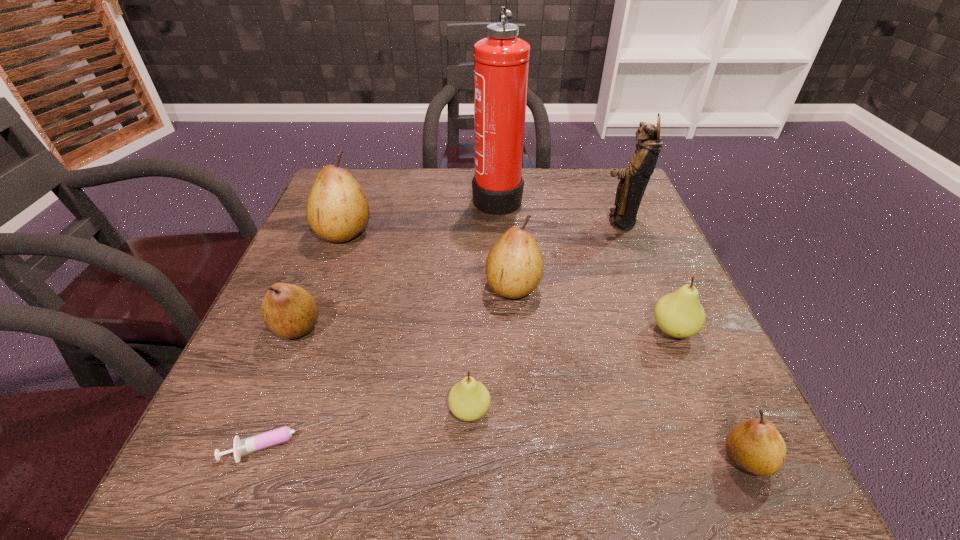
What are the coordinates of `figurine that is at the far edge` in the screenshot? It's located at (634, 179).

At what (x,y) coordinates should I click in order to perform the action: click on pear that is positioned at the near edge. Please return your answer as a coordinate pair (x, y). The image size is (960, 540). Looking at the image, I should click on (755, 445).

Where is `syringe located at the near edge`? syringe located at the near edge is located at coordinates (280, 435).

What are the coordinates of `syringe that is at the left edge` in the screenshot? It's located at (280, 435).

This screenshot has height=540, width=960. In order to click on figurine present at the right edge in this screenshot , I will do `click(634, 179)`.

Locate an element on the screen. The height and width of the screenshot is (540, 960). object that is at the near left corner is located at coordinates (280, 435).

You are a GUI agent. You are given a task and a screenshot of the screen. Output one action in this format:
    pyautogui.click(x=<x>, y=<y>)
    Task: Click on the object at the far right corner
    The image size is (960, 540).
    Given the screenshot: What is the action you would take?
    pyautogui.click(x=634, y=179)

This screenshot has width=960, height=540. Find the location of `object situated at the near right corner`. object situated at the near right corner is located at coordinates (755, 445).

You are a GUI agent. You are given a task and a screenshot of the screen. Output one action in this format:
    pyautogui.click(x=<x>, y=<y>)
    Task: Click on the vacant space at the far edge
    
    Given the screenshot: What is the action you would take?
    pyautogui.click(x=402, y=204)

This screenshot has width=960, height=540. In the image, there is a desktop. In order to click on free space at the near edge in this screenshot , I will do `click(304, 455)`.